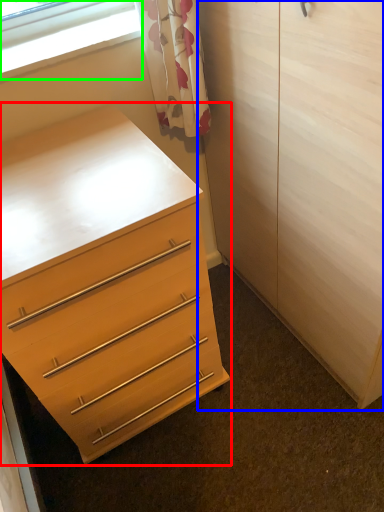
Question: Based on their relative distances, which object is nearer to chest of drawers (highlighted by a red box)? Choose from armoire (highlighted by a blue box) and window (highlighted by a green box).

Choices:
 (A) armoire
 (B) window

Answer: (A)